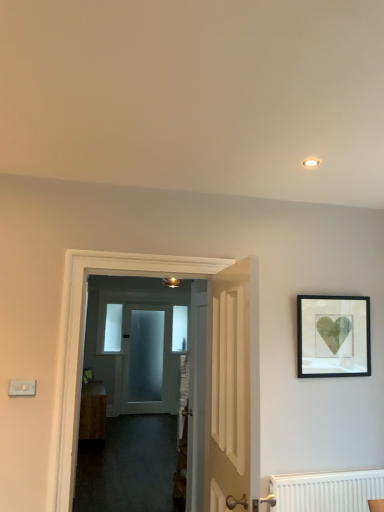
Question: Does wooden cabinet at center have a lesser height compared to white wooden door at center, the 1th door when ordered from front to back?

Choices:
 (A) yes
 (B) no

Answer: (A)

Question: Does wooden cabinet at center have a greater width compared to white wooden door at center, which is the 3th door from back to front?

Choices:
 (A) yes
 (B) no

Answer: (A)

Question: Considering the relative positions of wooden cabinet at center and white wooden door at center, the 1th door when ordered from front to back, in the image provided, is wooden cabinet at center in front of white wooden door at center, the 1th door when ordered from front to back,?

Choices:
 (A) yes
 (B) no

Answer: (B)

Question: Can you confirm if wooden cabinet at center is positioned to the left of white wooden door at center, which is the 3th door from back to front?

Choices:
 (A) no
 (B) yes

Answer: (B)

Question: From the image's perspective, does wooden cabinet at center appear lower than white wooden door at center, the 1th door when ordered from front to back?

Choices:
 (A) no
 (B) yes

Answer: (B)

Question: From their relative heights in the image, would you say wooden cabinet at center is taller or shorter than white wooden door at center, which is counted as the second door, starting from the back?

Choices:
 (A) tall
 (B) short

Answer: (B)

Question: In the image, is wooden cabinet at center positioned in front of or behind white wooden door at center, which is counted as the second door, starting from the back?

Choices:
 (A) front
 (B) behind

Answer: (B)

Question: Considering the relative positions of wooden cabinet at center and white wooden door at center, which is counted as the second door, starting from the back, in the image provided, is wooden cabinet at center to the left or to the right of white wooden door at center, which is counted as the second door, starting from the back,?

Choices:
 (A) right
 (B) left

Answer: (B)

Question: In terms of width, does wooden cabinet at center look wider or thinner when compared to white wooden door at center, which is counted as the second door, starting from the back?

Choices:
 (A) wide
 (B) thin

Answer: (A)

Question: Is white wooden door at center, which is counted as the second door, starting from the back, taller or shorter than clear glass window at center, which ranks as the 1th window in right-to-left order?

Choices:
 (A) tall
 (B) short

Answer: (A)

Question: In terms of width, does white wooden door at center, which is counted as the second door, starting from the back, look wider or thinner when compared to clear glass window at center, acting as the 2th window starting from the front?

Choices:
 (A) thin
 (B) wide

Answer: (B)

Question: From the image's perspective, relative to clear glass window at center, which ranks as the 1th window in right-to-left order, is white wooden door at center, which is counted as the second door, starting from the back, above or below?

Choices:
 (A) above
 (B) below

Answer: (A)

Question: In the image, is white wooden door at center, which is counted as the second door, starting from the back, positioned in front of or behind clear glass window at center, acting as the 2th window starting from the front?

Choices:
 (A) front
 (B) behind

Answer: (A)

Question: From the image's perspective, relative to wooden cabinet at center, is black matte picture frame at upper right above or below?

Choices:
 (A) above
 (B) below

Answer: (A)

Question: Relative to wooden cabinet at center, is black matte picture frame at upper right in front or behind?

Choices:
 (A) behind
 (B) front

Answer: (B)